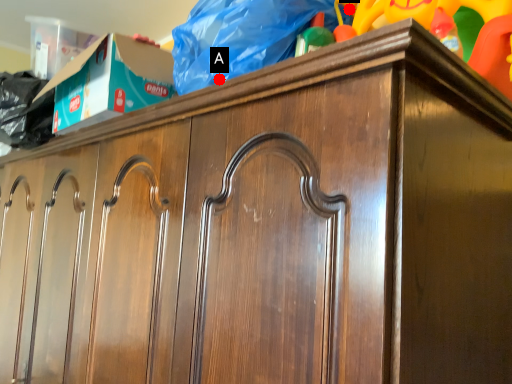
Question: Two points are circled on the image, labeled by A and B beside each circle. Which point is closer to the camera taking this photo?

Choices:
 (A) A is closer
 (B) B is closer

Answer: (A)